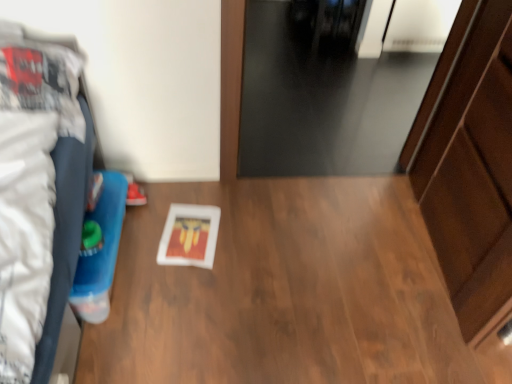
You are a GUI agent. You are given a task and a screenshot of the screen. Output one action in this format:
    pyautogui.click(x=<x>, y=<y>)
    Task: Click on the free space above black glass door at upper center (from a real-world perspective)
    
    Given the screenshot: What is the action you would take?
    click(x=301, y=76)